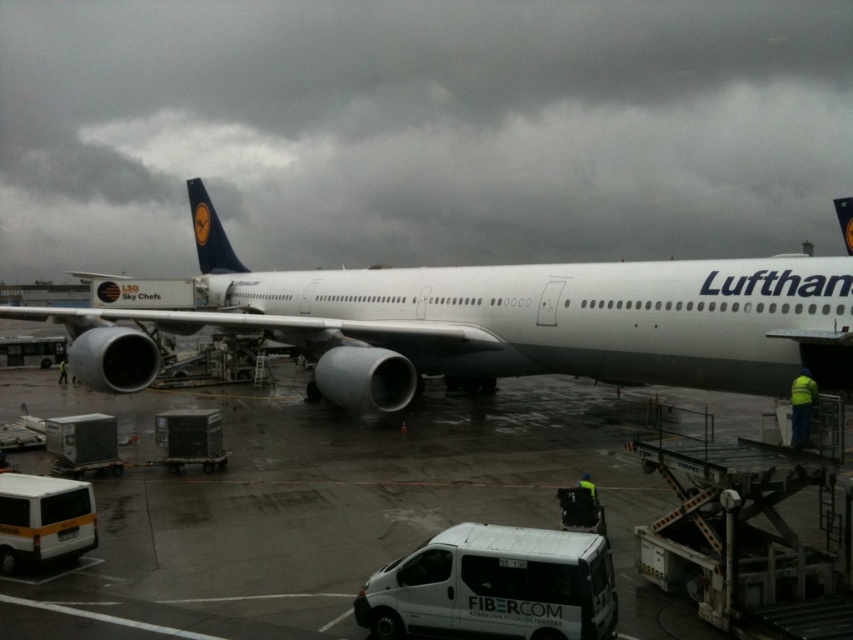
Question: Which point is farther from the camera taking this photo?

Choices:
 (A) (80, 348)
 (B) (566, 541)
 (C) (28, 563)

Answer: (A)

Question: Which object is the closest to the white matte van at lower center?

Choices:
 (A) white matte van at lower left
 (B) white metallic airplane at center

Answer: (A)

Question: From the image, what is the correct spatial relationship of white metallic airplane at center in relation to white matte van at lower left?

Choices:
 (A) above
 (B) below

Answer: (A)

Question: Does white matte van at lower center have a larger size compared to white matte van at lower left?

Choices:
 (A) no
 (B) yes

Answer: (B)

Question: Is white matte van at lower center further to the viewer compared to white matte van at lower left?

Choices:
 (A) yes
 (B) no

Answer: (B)

Question: Which object is closer to the camera taking this photo?

Choices:
 (A) white matte van at lower center
 (B) white matte van at lower left

Answer: (A)